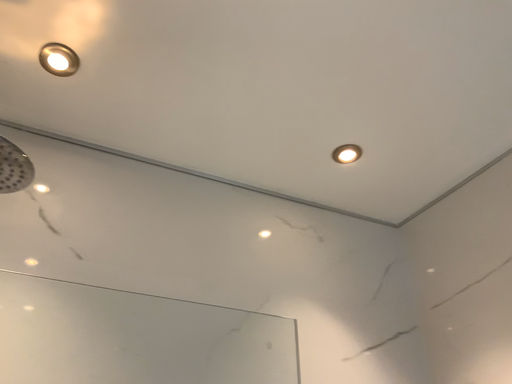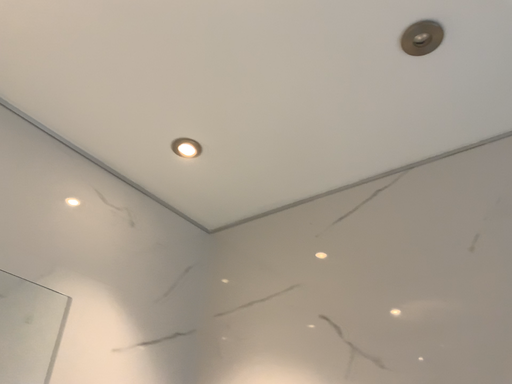
Question: How did the camera likely rotate when shooting the video?

Choices:
 (A) rotated right
 (B) rotated left

Answer: (A)